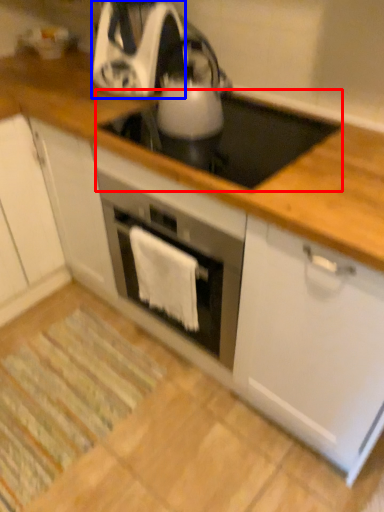
Question: Which object appears closest to the camera in this image, gas stove (highlighted by a red box) or kitchen appliance (highlighted by a blue box)?

Choices:
 (A) gas stove
 (B) kitchen appliance

Answer: (A)